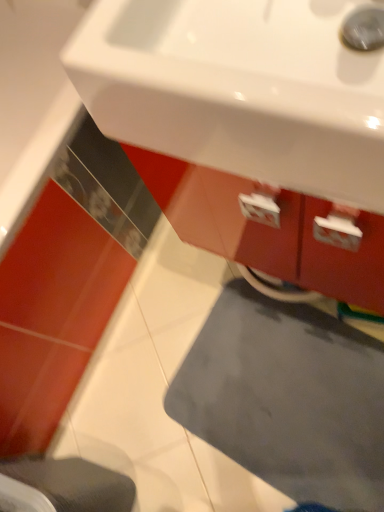
Question: From the image's perspective, is gray matte bath mat at lower center on gray fabric step stool at lower left?

Choices:
 (A) no
 (B) yes

Answer: (B)

Question: Is gray matte bath mat at lower center in contact with gray fabric step stool at lower left?

Choices:
 (A) no
 (B) yes

Answer: (A)

Question: From a real-world perspective, is gray matte bath mat at lower center positioned over gray fabric step stool at lower left based on gravity?

Choices:
 (A) no
 (B) yes

Answer: (A)

Question: Is gray matte bath mat at lower center shorter than gray fabric step stool at lower left?

Choices:
 (A) yes
 (B) no

Answer: (A)

Question: From the image's perspective, is gray matte bath mat at lower center located beneath gray fabric step stool at lower left?

Choices:
 (A) yes
 (B) no

Answer: (B)

Question: Considering the relative sizes of gray matte bath mat at lower center and gray fabric step stool at lower left in the image provided, is gray matte bath mat at lower center thinner than gray fabric step stool at lower left?

Choices:
 (A) no
 (B) yes

Answer: (A)

Question: Considering the relative positions of gray fabric step stool at lower left and white glossy sink at upper center in the image provided, is gray fabric step stool at lower left to the left of white glossy sink at upper center from the viewer's perspective?

Choices:
 (A) no
 (B) yes

Answer: (B)

Question: Is gray fabric step stool at lower left touching white glossy sink at upper center?

Choices:
 (A) yes
 (B) no

Answer: (B)

Question: Is gray fabric step stool at lower left wider than white glossy sink at upper center?

Choices:
 (A) yes
 (B) no

Answer: (B)

Question: Is gray fabric step stool at lower left further to the viewer compared to white glossy sink at upper center?

Choices:
 (A) no
 (B) yes

Answer: (B)

Question: Is white glossy sink at upper center at the back of gray fabric step stool at lower left?

Choices:
 (A) no
 (B) yes

Answer: (A)

Question: From a real-world perspective, is gray fabric step stool at lower left positioned over white glossy sink at upper center based on gravity?

Choices:
 (A) no
 (B) yes

Answer: (A)

Question: Is white glossy sink at upper center directly adjacent to gray fabric step stool at lower left?

Choices:
 (A) yes
 (B) no

Answer: (B)